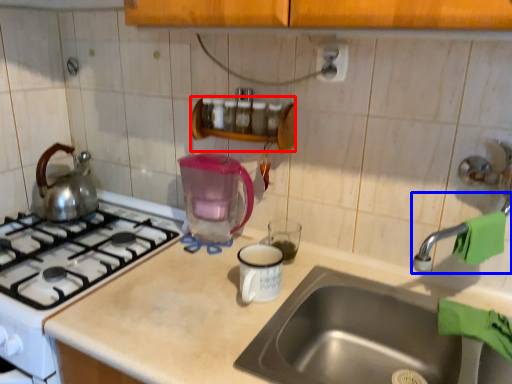
Question: Which of the following is the farthest to the observer, shelf (highlighted by a red box) or faucet (highlighted by a blue box)?

Choices:
 (A) shelf
 (B) faucet

Answer: (A)